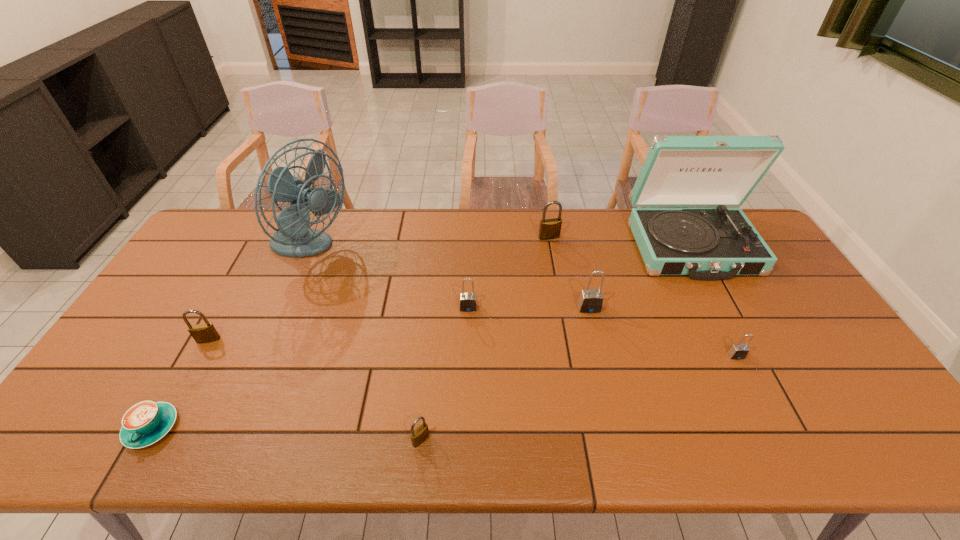
Identify the location of free spot located on the shackle of the fifth object from right to left. The width and height of the screenshot is (960, 540). (466, 421).

Locate an element on the screen. vacant area situated 0.240m on the back of the second nearest brass padlock is located at coordinates (244, 276).

The width and height of the screenshot is (960, 540). Find the location of `vacant space positioned on the shackle of the smallest gray padlock`. vacant space positioned on the shackle of the smallest gray padlock is located at coordinates (785, 453).

At what (x,y) coordinates should I click in order to perform the action: click on free space located 0.120m on the back of the fifth padlock from right to left. Please return your answer as a coordinate pair (x, y). The height and width of the screenshot is (540, 960). Looking at the image, I should click on (426, 386).

Locate an element on the screen. The image size is (960, 540). fan that is at the far edge is located at coordinates (294, 238).

In order to click on record player that is at the far edge in this screenshot , I will do `click(717, 243)`.

In order to click on padlock at the far edge in this screenshot , I will do `click(549, 229)`.

Locate an element on the screen. This screenshot has width=960, height=540. padlock that is at the near edge is located at coordinates (418, 436).

Locate an element on the screen. The width and height of the screenshot is (960, 540). cappuccino that is positioned at the near edge is located at coordinates (146, 422).

I want to click on object positioned at the left edge, so click(x=146, y=422).